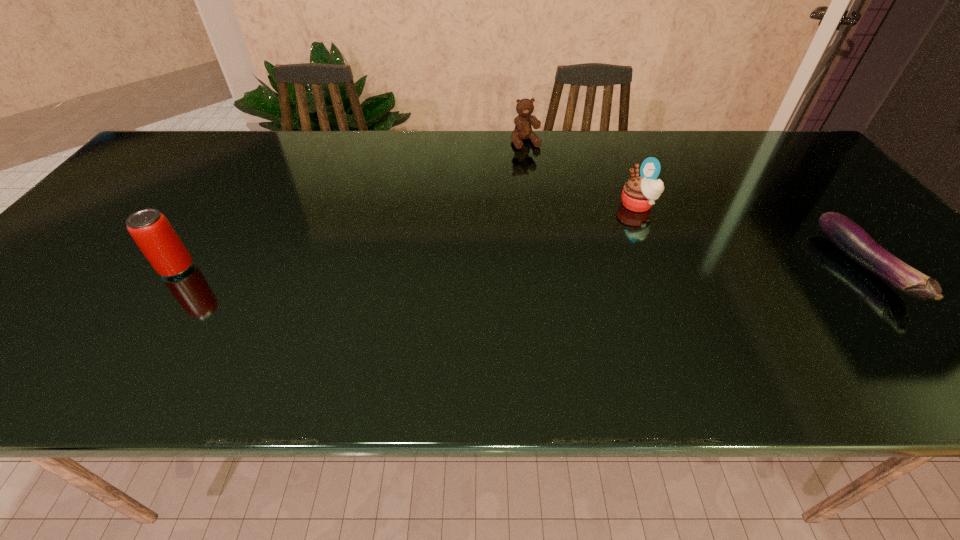
Locate an element on the screen. The height and width of the screenshot is (540, 960). free space on the desktop that is between the leftmost object and the eggplant and is positioned on the face of the teddy bear is located at coordinates (590, 268).

Identify the location of vacant space on the desktop that is between the leftmost object and the eggplant and is positioned on the front-facing side of the third nearest object. (505, 268).